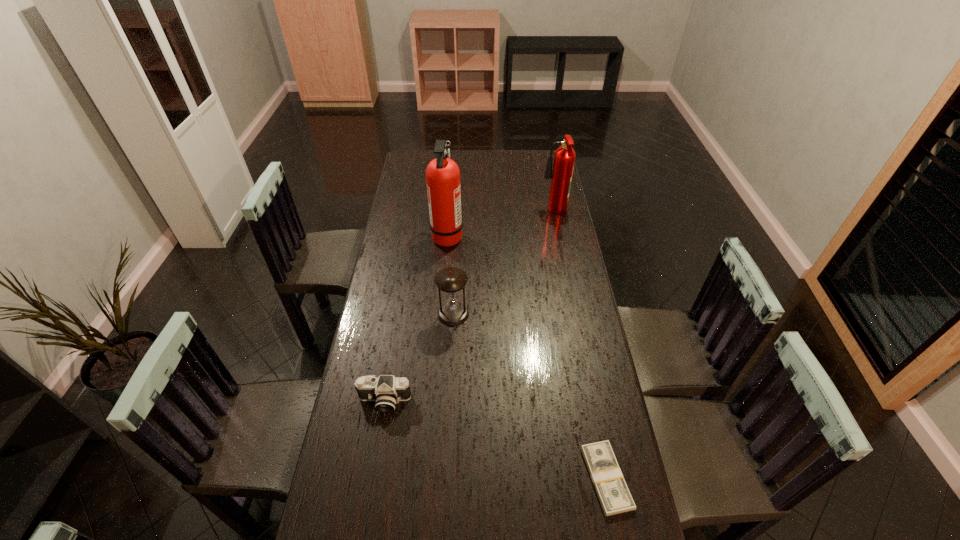
Locate an element on the screen. The image size is (960, 540). the tallest object is located at coordinates 442,174.

At what (x,y) coordinates should I click in order to perform the action: click on the left fire extinguisher. Please return your answer as a coordinate pair (x, y). Looking at the image, I should click on (442, 174).

At what (x,y) coordinates should I click in order to perform the action: click on the fourth shortest object. Please return your answer as a coordinate pair (x, y). This screenshot has height=540, width=960. Looking at the image, I should click on (564, 159).

Find the location of a particular element. The height and width of the screenshot is (540, 960). the shorter fire extinguisher is located at coordinates (564, 159).

Identify the location of the third nearest object. (451, 280).

Find the location of a particular element. This screenshot has height=540, width=960. the third tallest object is located at coordinates (451, 280).

Find the location of a particular element. Image resolution: width=960 pixels, height=540 pixels. the leftmost object is located at coordinates (387, 390).

At what (x,y) coordinates should I click in order to perform the action: click on the fourth farthest object. Please return your answer as a coordinate pair (x, y). This screenshot has width=960, height=540. Looking at the image, I should click on (387, 390).

Where is `dollar`? The image size is (960, 540). dollar is located at coordinates (613, 493).

Locate an element on the screen. the nearest object is located at coordinates (613, 493).